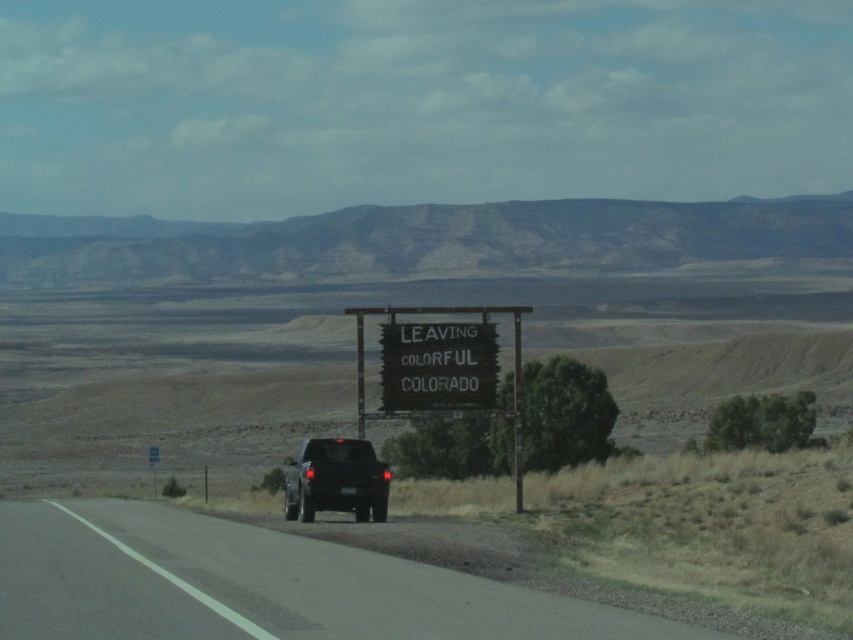
You are standing at the camera position and want to reach the point marked at coordinates point (x=97, y=634). If your walking speed is 3 feet per second, how many seconds will it take you to reach that point?

The distance to point (x=97, y=634) is 39.64 feet. At a speed of 3 feet per second, it would take 13.21 seconds to reach the point.

You are standing at the point closer to the camera between the two points, point (405, 360) and point (379, 314). Which point are you standing at?

You are standing at point (405, 360) because it is further to the camera than point (379, 314).

You are driving along the road and see the black plastic sign at center and the wooden signboard at center. Which one is closer to the left side of the road?

The black plastic sign at center is to the left of wooden signboard at center, so it is closer to the left side of the road.